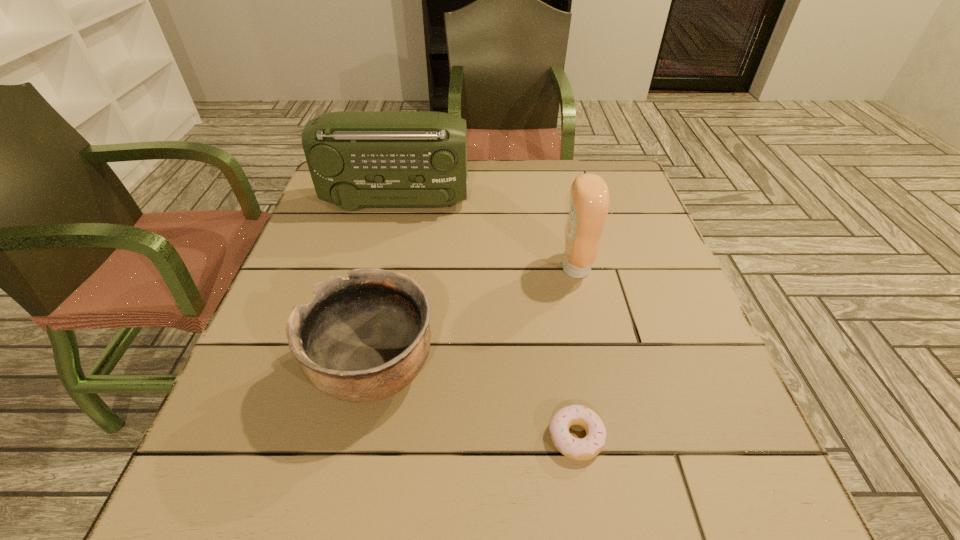
Locate an element on the screen. Image resolution: width=960 pixels, height=540 pixels. vacant area that satisfies the following two spatial constraints: 1. on the front-facing side of the pottery; 2. on the right side of the farthest object is located at coordinates (356, 369).

Where is `blank space that satisfies the following two spatial constraints: 1. on the front-facing side of the second shortest object; 2. on the left side of the radio_receiver`? blank space that satisfies the following two spatial constraints: 1. on the front-facing side of the second shortest object; 2. on the left side of the radio_receiver is located at coordinates (356, 369).

Identify the location of free space that satisfies the following two spatial constraints: 1. on the front-facing side of the doughnut; 2. on the right side of the radio_receiver. Image resolution: width=960 pixels, height=540 pixels. click(x=341, y=437).

Locate an element on the screen. vacant region that satisfies the following two spatial constraints: 1. on the front side of the pottery; 2. on the left side of the shortest object is located at coordinates (361, 437).

This screenshot has height=540, width=960. In order to click on free spot that satisfies the following two spatial constraints: 1. on the front-facing side of the farthest object; 2. on the right side of the doughnut in this screenshot , I will do `click(341, 437)`.

Where is `vacant space that satisfies the following two spatial constraints: 1. on the front-facing side of the third tallest object; 2. on the left side of the radio_receiver`? The image size is (960, 540). vacant space that satisfies the following two spatial constraints: 1. on the front-facing side of the third tallest object; 2. on the left side of the radio_receiver is located at coordinates (356, 369).

The image size is (960, 540). What are the coordinates of `free point that satisfies the following two spatial constraints: 1. on the front-facing side of the radio_receiver; 2. on the right side of the doughnut` in the screenshot? It's located at (341, 437).